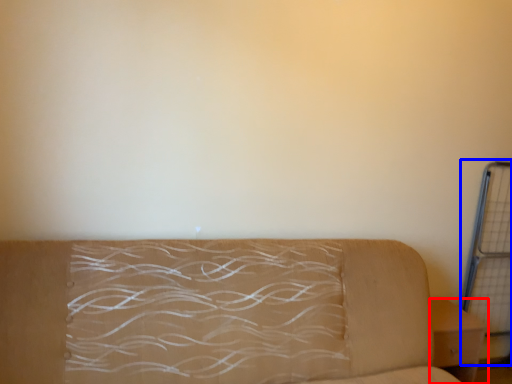
Question: Which of the following is the closest to the observer, furniture (highlighted by a red box) or cage (highlighted by a blue box)?

Choices:
 (A) furniture
 (B) cage

Answer: (A)